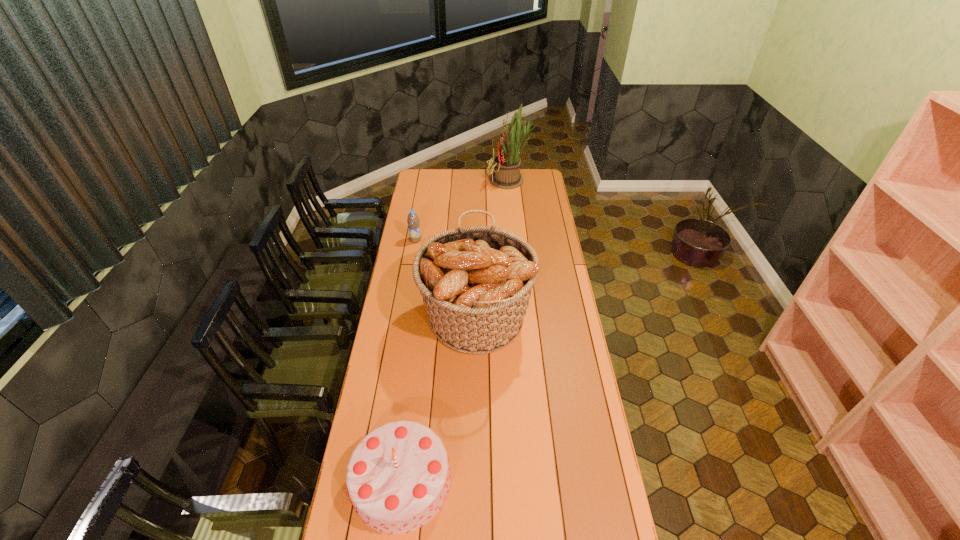
What are the coordinates of `blank space located 0.100m in front of the tallest object with the fan visible` in the screenshot? It's located at (471, 181).

This screenshot has width=960, height=540. I want to click on vacant space located 0.080m on the front of the third shortest object, so click(x=476, y=386).

At what (x,y) coordinates should I click in order to perform the action: click on free spot located 0.220m on the back of the nearest object. Please return your answer as a coordinate pair (x, y). This screenshot has height=540, width=960. Looking at the image, I should click on (414, 382).

The image size is (960, 540). Find the location of `free spot located on the right of the third nearest object`. free spot located on the right of the third nearest object is located at coordinates (471, 240).

You are a GUI agent. You are given a task and a screenshot of the screen. Output one action in this format:
    pyautogui.click(x=<x>, y=<y>)
    Task: Click on the object at the far edge
    Image resolution: width=960 pixels, height=540 pixels.
    Given the screenshot: What is the action you would take?
    pyautogui.click(x=506, y=166)

The width and height of the screenshot is (960, 540). Find the location of `basket that is at the left edge`. basket that is at the left edge is located at coordinates (476, 282).

Identify the location of birthday cake that is at the left edge. The height and width of the screenshot is (540, 960). (398, 477).

Identify the location of water bottle present at the left edge. (413, 221).

Locate an element on the screen. object that is at the right edge is located at coordinates (506, 166).

Locate an element on the screen. object that is positioned at the far right corner is located at coordinates (506, 166).